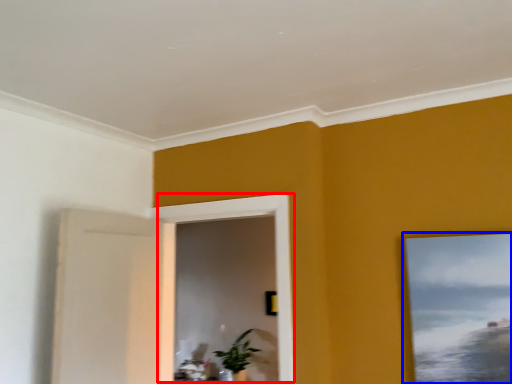
Question: Which object appears closest to the camera in this image, window (highlighted by a red box) or picture frame (highlighted by a blue box)?

Choices:
 (A) window
 (B) picture frame

Answer: (B)